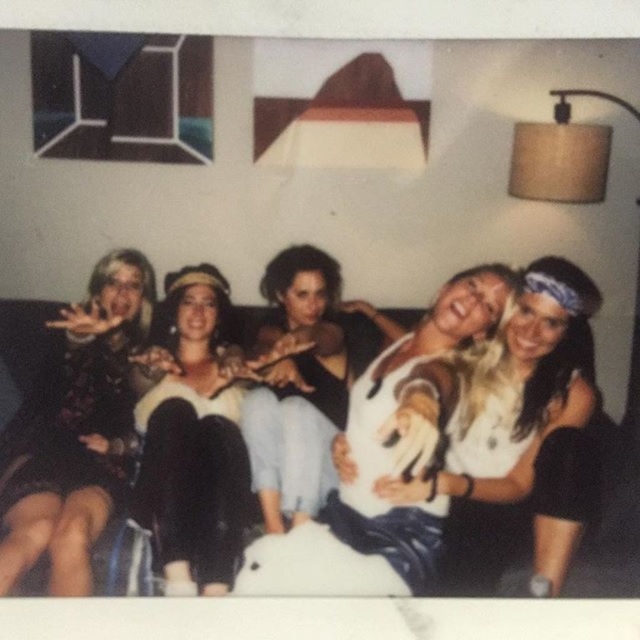
You are a photographer setting up for a group photo. The matte floral dress at left and the black fabric couch at center are in your frame. Based on their sizes, can the dress potentially cover the entire couch if placed on it?

The matte floral dress at left might be wider than black fabric couch at center, so it could potentially cover the entire couch if placed on it depending on their exact dimensions.

You are standing in the living room and want to take a photo of the matte floral dress at left. If your camera has a minimum focus distance of 36 inches, will you need to move closer or farther away to capture a clear photo?

The distance between the matte floral dress at left and the camera is 37.06 inches. Since the camera requires a minimum focus distance of 36 inches, you are already within range. To ensure clarity, you might need to move slightly closer, but since 37.06 inches is just beyond the minimum, staying at this distance should work. However, if the camera cannot focus beyond 36 inches, moving closer would be necessary.